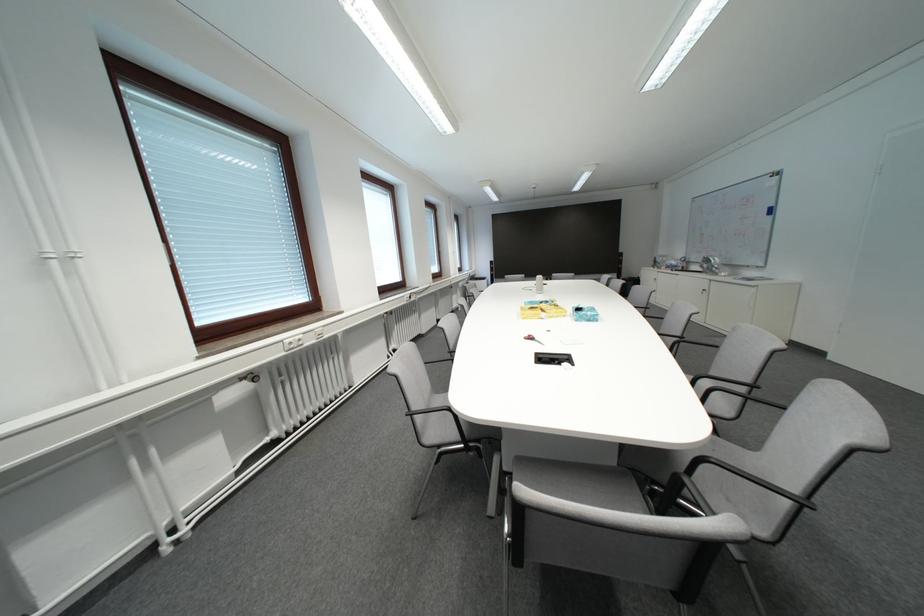
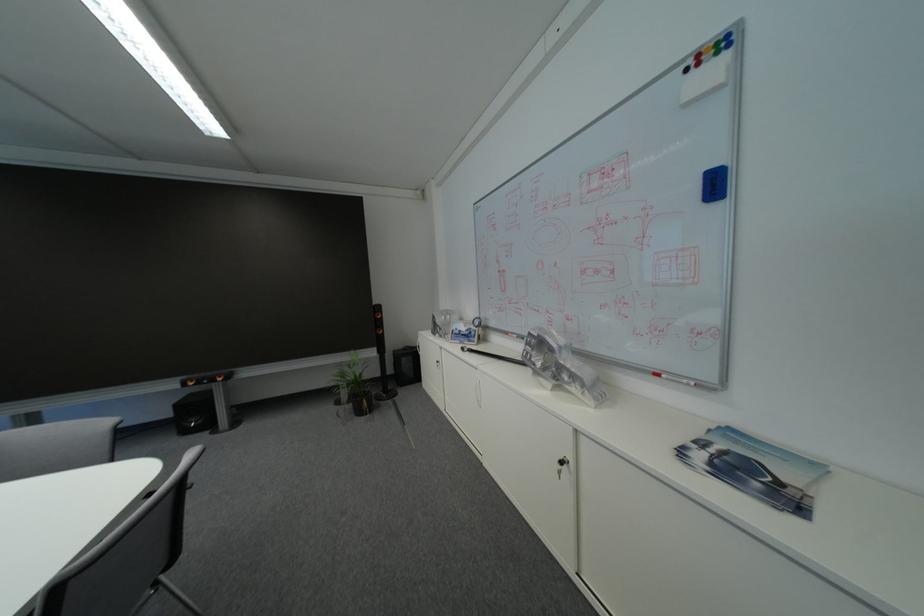
Where in the second image is the point corresponding to pixel 785 172 from the first image?

(723, 34)